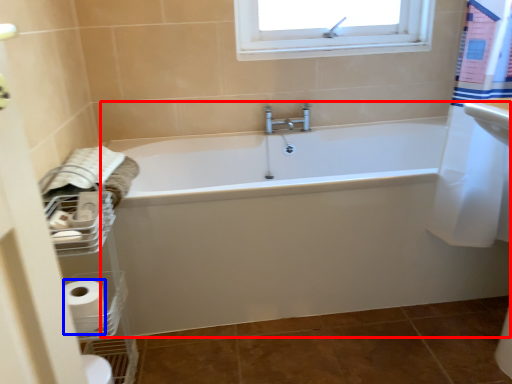
Question: Which object appears farthest to the camera in this image, bathtub (highlighted by a red box) or toilet paper (highlighted by a blue box)?

Choices:
 (A) bathtub
 (B) toilet paper

Answer: (A)